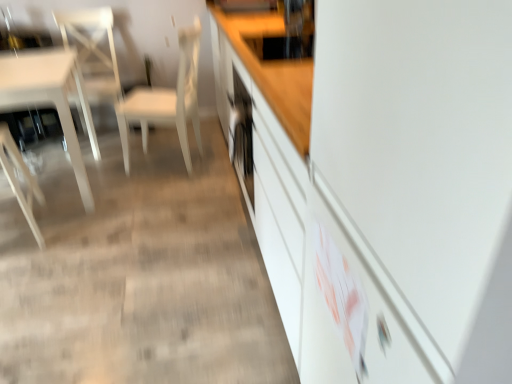
Question: Which is correct: wooden chair at left, which appears as the third chair when viewed from the right, is inside white glossy cabinet at center, or outside of it?

Choices:
 (A) outside
 (B) inside

Answer: (A)

Question: In terms of size, does wooden chair at left, the 1th chair in the left-to-right sequence, appear bigger or smaller than white glossy cabinet at center?

Choices:
 (A) small
 (B) big

Answer: (A)

Question: Which object is the closest to the white matte chair at center, positioned as the 3th chair in left-to-right order?

Choices:
 (A) white glossy cabinet at center
 (B) white glossy table at left
 (C) white glossy chair at left, the 2th chair when ordered from right to left
 (D) wooden chair at left, which appears as the third chair when viewed from the right

Answer: (C)

Question: Which is nearer to the white glossy chair at left, the 2th chair when ordered from left to right?

Choices:
 (A) white matte chair at center, positioned as the 3th chair in left-to-right order
 (B) wooden chair at left, the 1th chair in the left-to-right sequence
 (C) white glossy cabinet at center
 (D) white glossy table at left

Answer: (D)